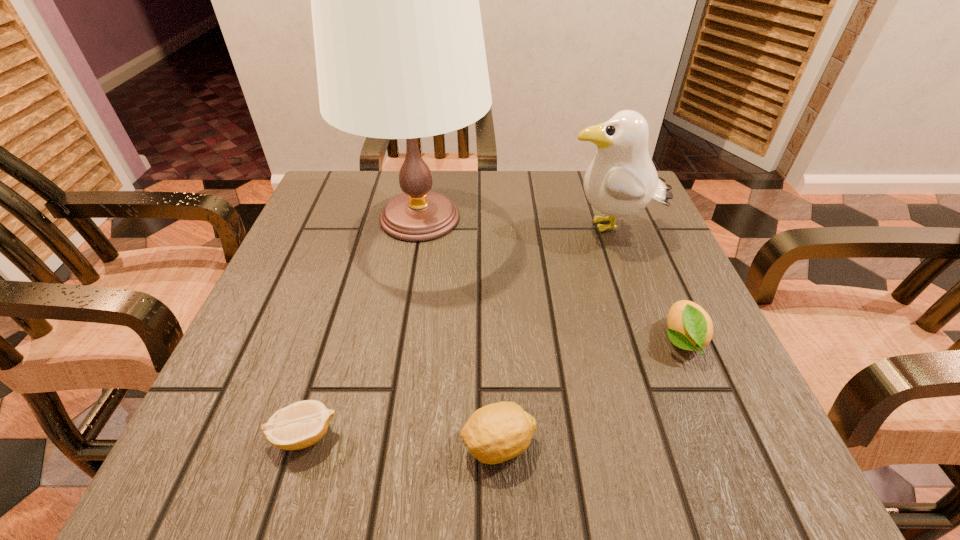
In order to click on vacant space located on the beak of the gull in this screenshot , I will do `click(397, 228)`.

Identify the location of vacant space located with leaves positioned above the rightmost lemon. The image size is (960, 540). (730, 455).

This screenshot has width=960, height=540. Find the location of `vacant space situated at the stem end of the second lemon from left to right`. vacant space situated at the stem end of the second lemon from left to right is located at coordinates (227, 444).

Where is `vacant space situated at the stem end of the second lemon from left to right`? The image size is (960, 540). vacant space situated at the stem end of the second lemon from left to right is located at coordinates (234, 444).

The height and width of the screenshot is (540, 960). Identify the location of free space located at the stem end of the second lemon from left to right. (242, 444).

Identify the location of vacant space located 0.270m on the right of the shortest lemon. (533, 435).

Where is `lamp that is at the far edge`? Image resolution: width=960 pixels, height=540 pixels. lamp that is at the far edge is located at coordinates (399, 46).

Find the location of a particular element. This screenshot has width=960, height=540. gull that is at the far edge is located at coordinates (621, 180).

At what (x,y) coordinates should I click in order to perform the action: click on lamp present at the left edge. Please return your answer as a coordinate pair (x, y). The image size is (960, 540). Looking at the image, I should click on (399, 46).

Where is `lemon that is at the left edge`? lemon that is at the left edge is located at coordinates (301, 424).